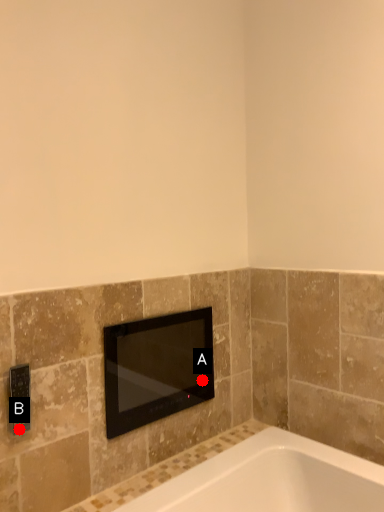
Question: Two points are circled on the image, labeled by A and B beside each circle. Which point is closer to the camera?

Choices:
 (A) A is closer
 (B) B is closer

Answer: (B)